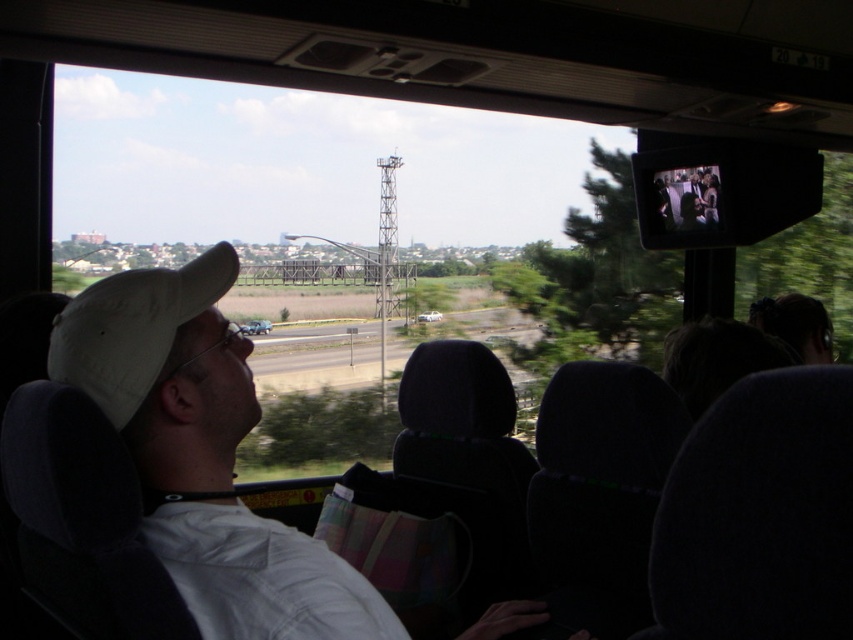
Question: Among these objects, which one is nearest to the camera?

Choices:
 (A) white matte baseball hat at left
 (B) white matte cap at upper left

Answer: (B)

Question: Which of the following is the closest to the observer?

Choices:
 (A) white matte baseball hat at left
 (B) white matte cap at upper left

Answer: (B)

Question: Where is white matte cap at upper left located in relation to white matte baseball hat at left in the image?

Choices:
 (A) below
 (B) above

Answer: (A)

Question: Which point is closer to the camera?

Choices:
 (A) white matte baseball hat at left
 (B) white matte cap at upper left

Answer: (B)

Question: Does white matte cap at upper left come in front of white matte baseball hat at left?

Choices:
 (A) yes
 (B) no

Answer: (A)

Question: Is white matte cap at upper left to the right of white matte baseball hat at left from the viewer's perspective?

Choices:
 (A) yes
 (B) no

Answer: (A)